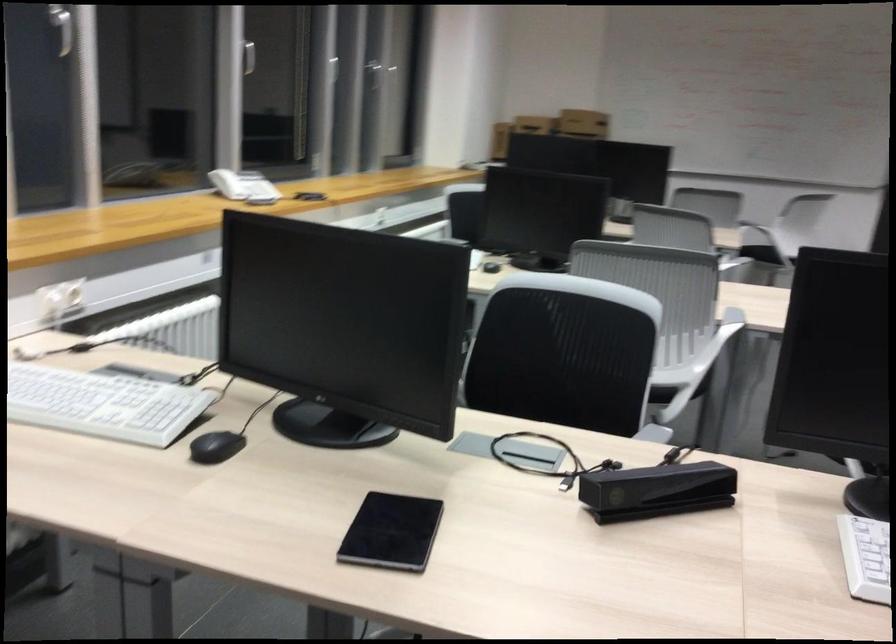
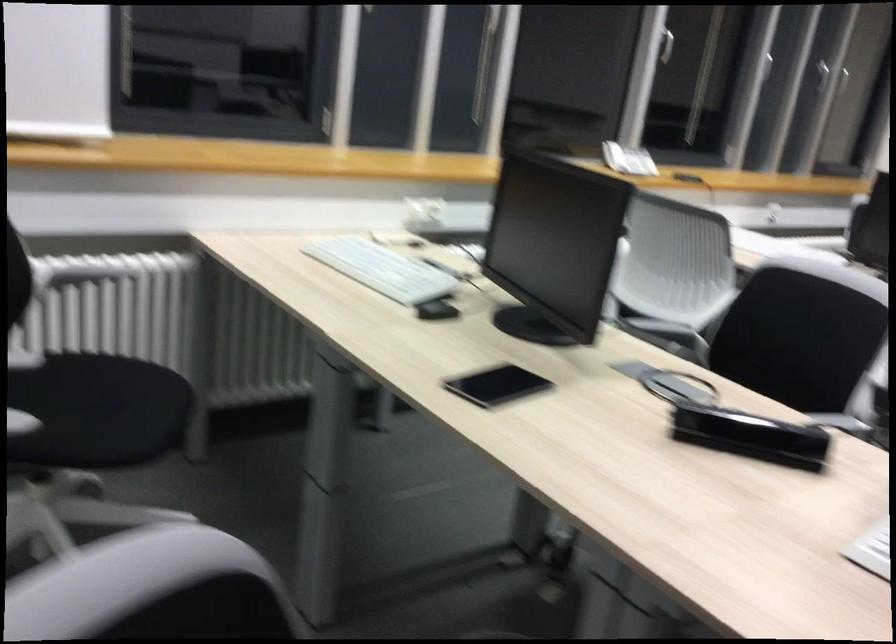
The point at (252, 69) is marked in the first image. Where is the corresponding point in the second image?

(666, 46)